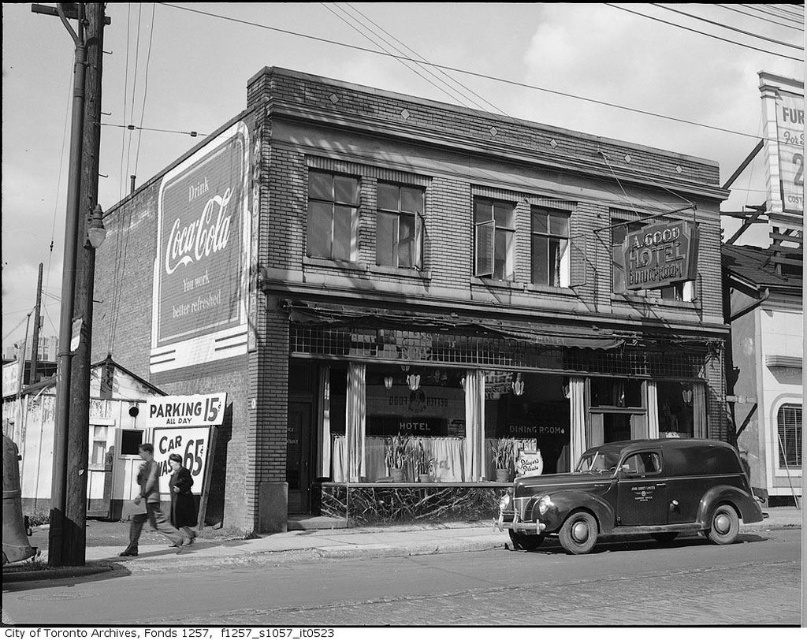
Does matte glass storefront at center have a greater width compared to shiny black sedan at center?

Yes, matte glass storefront at center is wider than shiny black sedan at center.

Between point (562, 465) and point (575, 477), which one is positioned in front?

Point (575, 477) is in front.

Locate an element on the screen. The height and width of the screenshot is (640, 807). matte glass storefront at center is located at coordinates (450, 397).